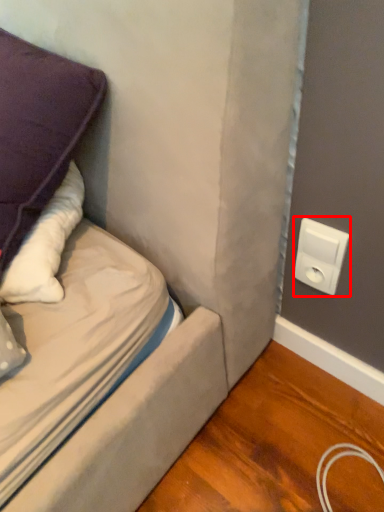
Question: Where is electric outlet (annotated by the red box) located in relation to pillow in the image?

Choices:
 (A) right
 (B) left

Answer: (A)